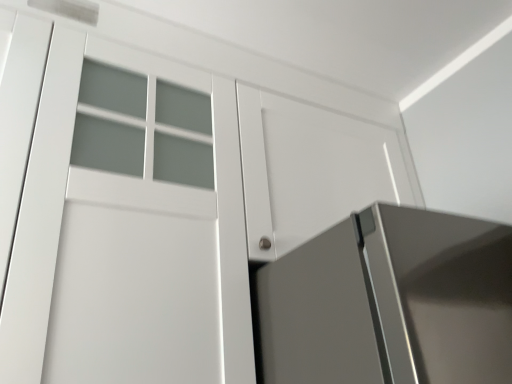
The height and width of the screenshot is (384, 512). Describe the element at coordinates (310, 170) in the screenshot. I see `white matte door at center` at that location.

Locate an element on the screen. The width and height of the screenshot is (512, 384). white matte door at center is located at coordinates (310, 170).

Where is `white matte door at center`? This screenshot has height=384, width=512. white matte door at center is located at coordinates (310, 170).